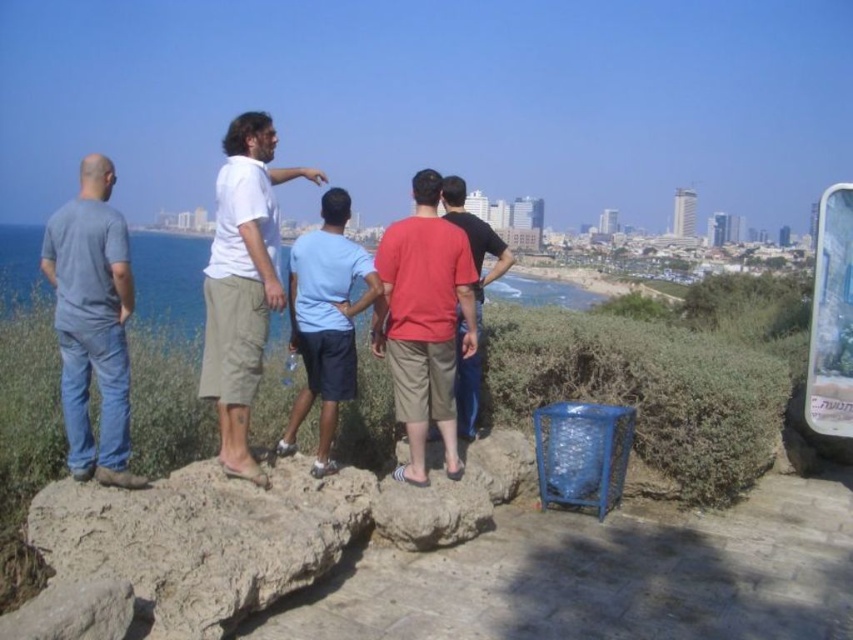
Question: Which object is closer to the camera taking this photo?

Choices:
 (A) matte red shirt at center
 (B) light beige shorts at center

Answer: (B)

Question: Which of the following is the farthest from the observer?

Choices:
 (A) denim jeans at left
 (B) light blue fabric shorts at center

Answer: (B)

Question: From the image, what is the correct spatial relationship of red cotton shirt at center in relation to matte red shirt at center?

Choices:
 (A) left
 (B) right

Answer: (A)

Question: Considering the relative positions of denim jeans at left and matte red shirt at center in the image provided, where is denim jeans at left located with respect to matte red shirt at center?

Choices:
 (A) below
 (B) above

Answer: (A)

Question: Which object appears closest to the camera in this image?

Choices:
 (A) denim jeans at left
 (B) light blue fabric shorts at center
 (C) light beige shorts at center

Answer: (A)

Question: Does denim jeans at left appear on the left side of light beige shorts at center?

Choices:
 (A) no
 (B) yes

Answer: (B)